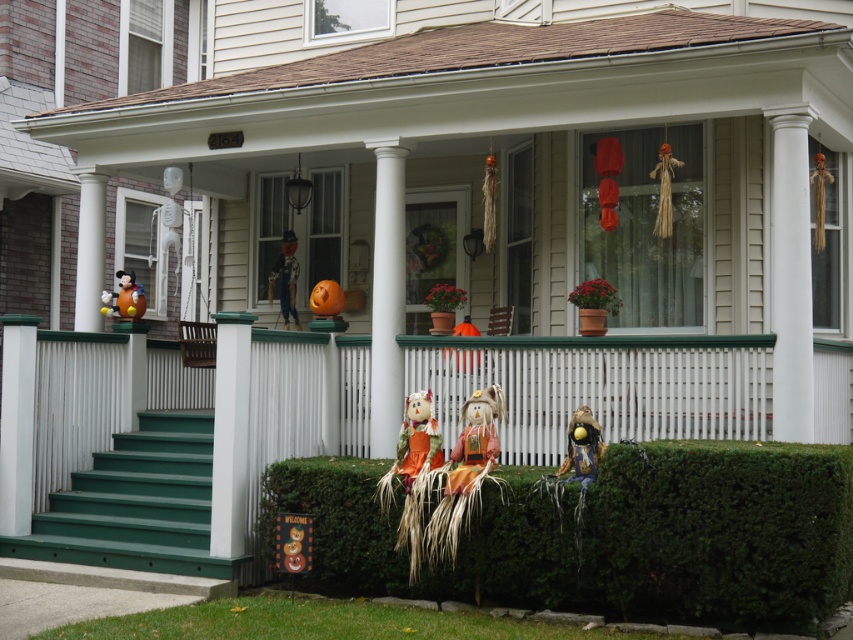
Consider the image. Can you confirm if green painted wood stairs at lower left is thinner than orange matte pumpkin at center?

In fact, green painted wood stairs at lower left might be wider than orange matte pumpkin at center.

Who is more forward, [99,518] or [339,301]?

Positioned in front is point [99,518].

The width and height of the screenshot is (853, 640). In order to click on green painted wood stairs at lower left in this screenshot , I will do `click(136, 504)`.

This screenshot has height=640, width=853. Find the location of `orange fabric scarecrow at center`. orange fabric scarecrow at center is located at coordinates (416, 438).

Does orange fabric scarecrow at center have a smaller size compared to shiny metallic scarecrow at lower center?

No.

What do you see at coordinates (416, 438) in the screenshot?
I see `orange fabric scarecrow at center` at bounding box center [416, 438].

What are the coordinates of `orange fabric scarecrow at center` in the screenshot? It's located at (416, 438).

Between green wood porch at lower center and shiny metallic scarecrow at lower center, which one is positioned lower?

shiny metallic scarecrow at lower center is below.

Which is in front, point (648, 342) or point (589, 449)?

Point (589, 449)

Where is `green wood porch at lower center`? The image size is (853, 640). green wood porch at lower center is located at coordinates (175, 406).